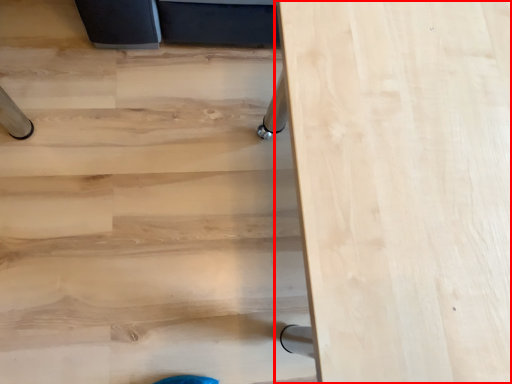
Question: From the image's perspective, what is the correct spatial relationship of table (annotated by the red box) in relation to stairwell?

Choices:
 (A) below
 (B) above

Answer: (A)